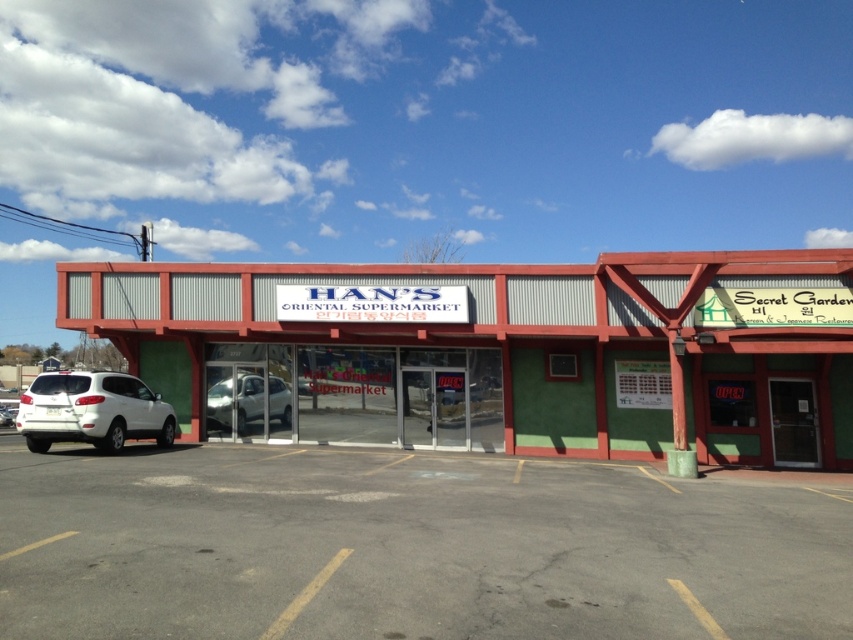
You are a delivery driver who needs to park your white matte suv at lower left near the entrance of the green corrugated metal building at center. Based on their positions, can you determine if you can park your SUV directly in front of the building without blocking the entrance?

The green corrugated metal building at center is to the right of the white matte suv at lower left, so parking the SUV directly in front of the building would not block the entrance as it is positioned to the side.

You are a delivery driver who needs to park your white matte suv at lower left near the entrance of the HAN S ORIENTAL SUPERMARKET. Given that the green corrugated metal building at center has a height restriction of 2 meters, can your suv safely park there without hitting the building?

The green corrugated metal building at center is taller than the white matte suv at lower left, so the suv can safely park there as it is shorter than the 2 meter height restriction.

You are standing at the camera position and want to park your white matte suv at lower left in the parking lot near HAN S ORIENTAL SUPERMARKET. Is the distance between your current position and the parking spot sufficient to make a U turn without hitting any obstacles?

The white matte suv at lower left and camera are 15.12 meters apart. A standard U turn requires about 10 meters of space. Since the distance is more than enough, you can safely make the U turn without hitting any obstacles.